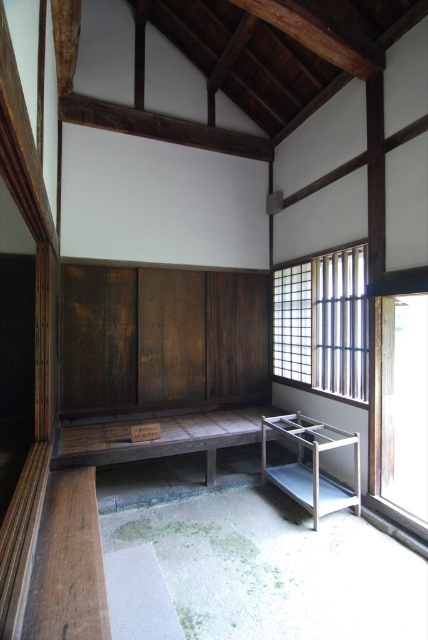
Can you confirm if translucent wood window at right is smaller than metallic silver bench at center?

Incorrect, translucent wood window at right is not smaller in size than metallic silver bench at center.

Where is `translucent wood window at right`? translucent wood window at right is located at coordinates (323, 323).

Does translucent wood window at right have a greater width compared to transparent glass window at right?

Incorrect, translucent wood window at right's width does not surpass transparent glass window at right's.

Is translucent wood window at right to the left of transparent glass window at right from the viewer's perspective?

Correct, you'll find translucent wood window at right to the left of transparent glass window at right.

Who is more distant from viewer, (341, 388) or (416, 468)?

The point (416, 468) is behind.

This screenshot has width=428, height=640. What are the coordinates of `translucent wood window at right` in the screenshot? It's located at pyautogui.click(x=323, y=323).

Can you confirm if wooden bench at center is shorter than metallic silver bench at center?

Yes.

What do you see at coordinates (160, 436) in the screenshot? I see `wooden bench at center` at bounding box center [160, 436].

The height and width of the screenshot is (640, 428). I want to click on wooden bench at center, so click(160, 436).